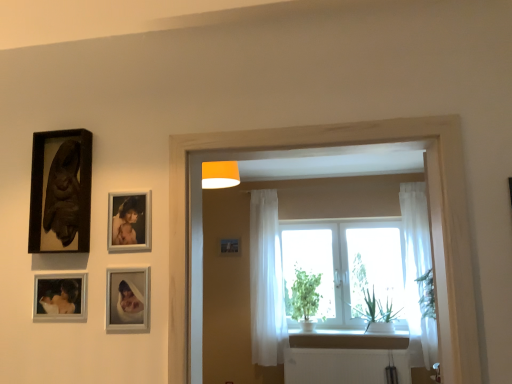
What are the coordinates of `empty space that is ontop of white sheer curtain at right, positioned as the second curtain in left-to-right order (from a real-world perspective)` in the screenshot? It's located at (411, 183).